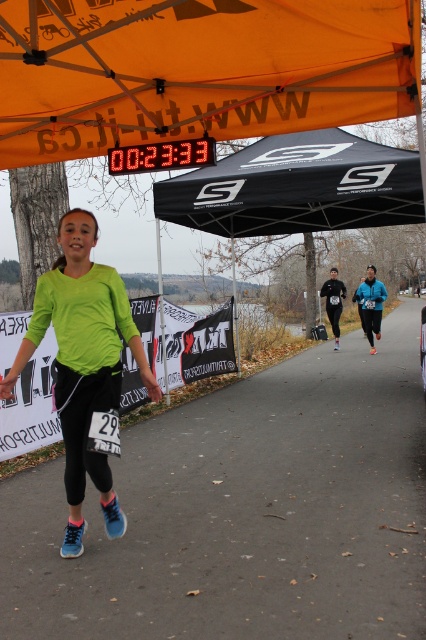
Question: Which point is farther to the camera?

Choices:
 (A) (29, 109)
 (B) (71, 541)
 (C) (264, 220)

Answer: (C)

Question: Which object appears farthest from the camera in this image?

Choices:
 (A) green fabric runner at center
 (B) black fabric tent at center
 (C) orange fabric canopy at upper center
 (D) black fabric canopy at upper center

Answer: (D)

Question: Which object appears farthest from the camera in this image?

Choices:
 (A) black fabric tent at center
 (B) blue mesh running shoe at lower left

Answer: (A)

Question: Where is orange fabric canopy at upper center located in relation to blue mesh running shoe at lower left in the image?

Choices:
 (A) below
 (B) above

Answer: (B)

Question: Is green fabric runner at center positioned at the back of orange fabric canopy at upper center?

Choices:
 (A) no
 (B) yes

Answer: (A)

Question: Does orange fabric canopy at upper center appear on the left side of black fabric canopy at upper center?

Choices:
 (A) yes
 (B) no

Answer: (A)